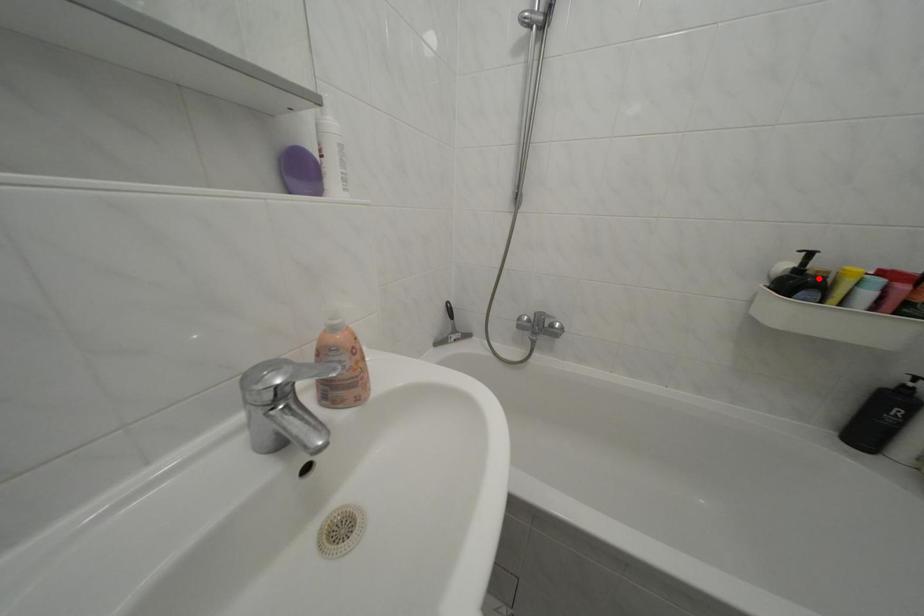
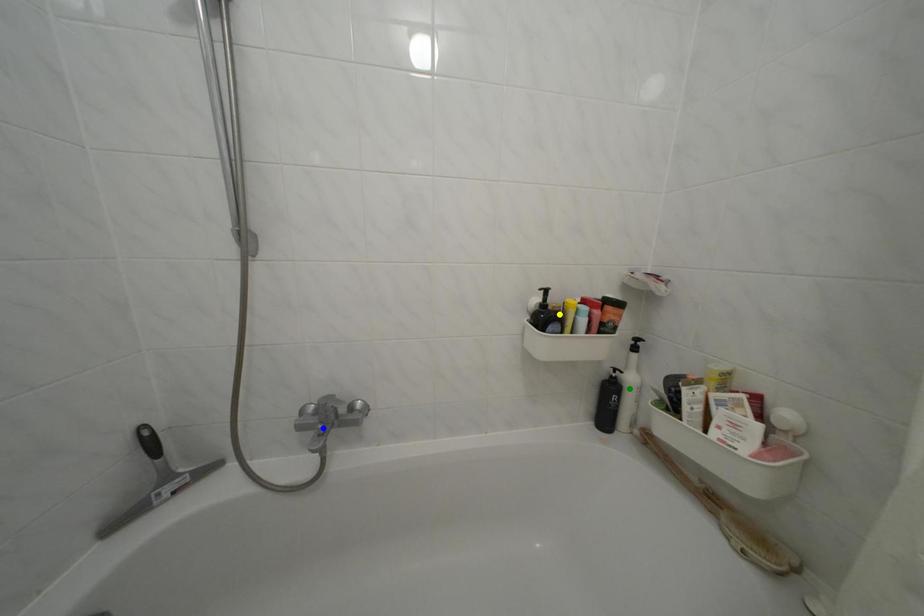
Question: I am providing you with two images of the same scene from different viewpoints. A red point is marked on the first image. You are given multiple points on the second image. Which spot in image 2 lines up with the point in image 1?

Choices:
 (A) blue point
 (B) green point
 (C) yellow point

Answer: (C)